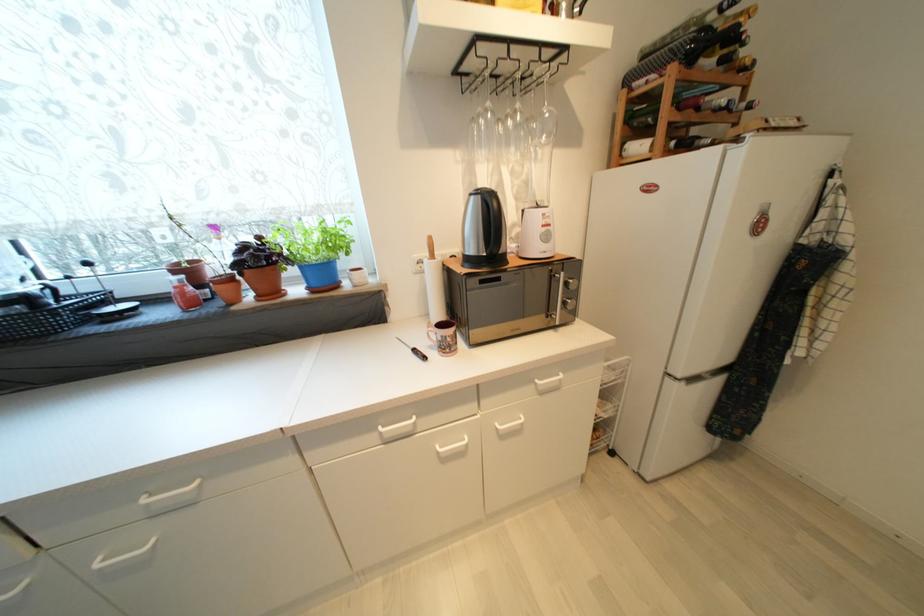
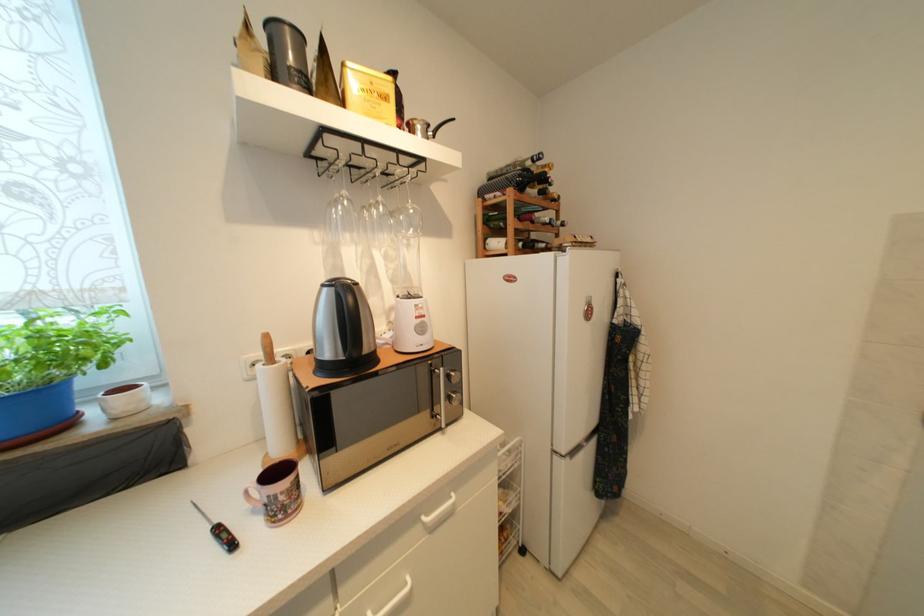
In the second image, find the point that corresponds to point 569,305 in the first image.

(455, 400)